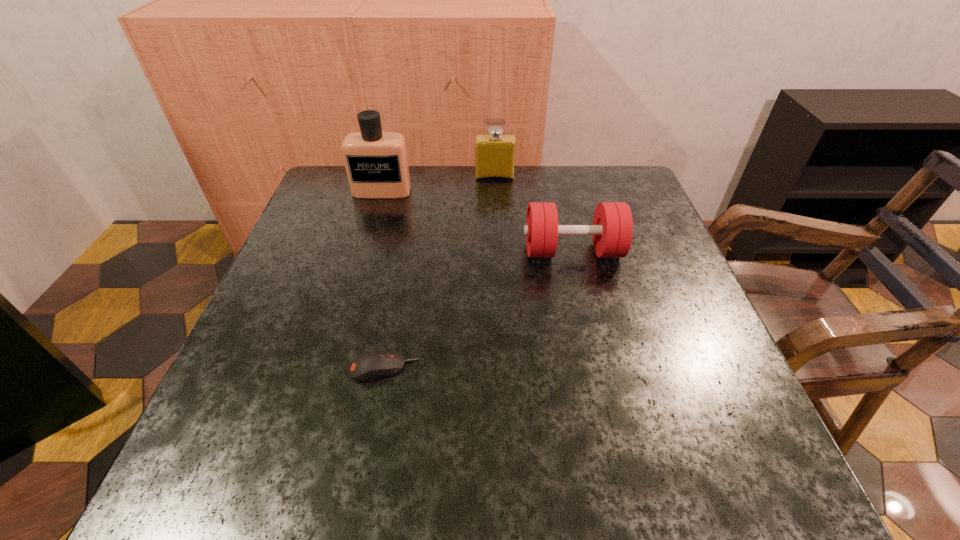
Locate an element on the screen. This screenshot has height=540, width=960. vacant area situated 0.210m on the left of the third farthest object is located at coordinates (429, 251).

Locate an element on the screen. vacant space situated 0.140m on the left of the computer mouse is located at coordinates (269, 368).

Image resolution: width=960 pixels, height=540 pixels. I want to click on object that is at the left edge, so click(x=376, y=163).

Find the location of a particular element. This screenshot has width=960, height=540. object that is at the right edge is located at coordinates (612, 229).

Where is `object that is at the far left corner`? object that is at the far left corner is located at coordinates (376, 163).

In the image, there is a desktop. Where is `vacant space at the far edge`? The width and height of the screenshot is (960, 540). vacant space at the far edge is located at coordinates (476, 207).

The width and height of the screenshot is (960, 540). In order to click on free region at the near edge of the desktop in this screenshot , I will do `click(307, 482)`.

You are a GUI agent. You are given a task and a screenshot of the screen. Output one action in this format:
    pyautogui.click(x=<x>, y=<y>)
    Task: Click on the free space at the left edge
    
    Given the screenshot: What is the action you would take?
    pyautogui.click(x=324, y=302)

Find the location of a particular element. This screenshot has height=540, width=960. free space at the right edge is located at coordinates (615, 299).

Locate an element on the screen. vacant space at the far left corner of the desktop is located at coordinates (343, 166).